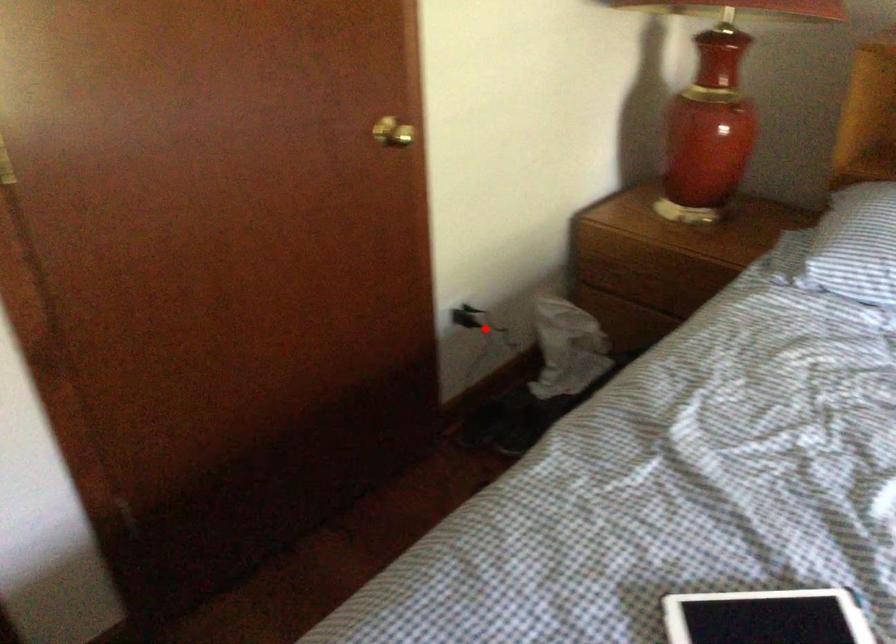
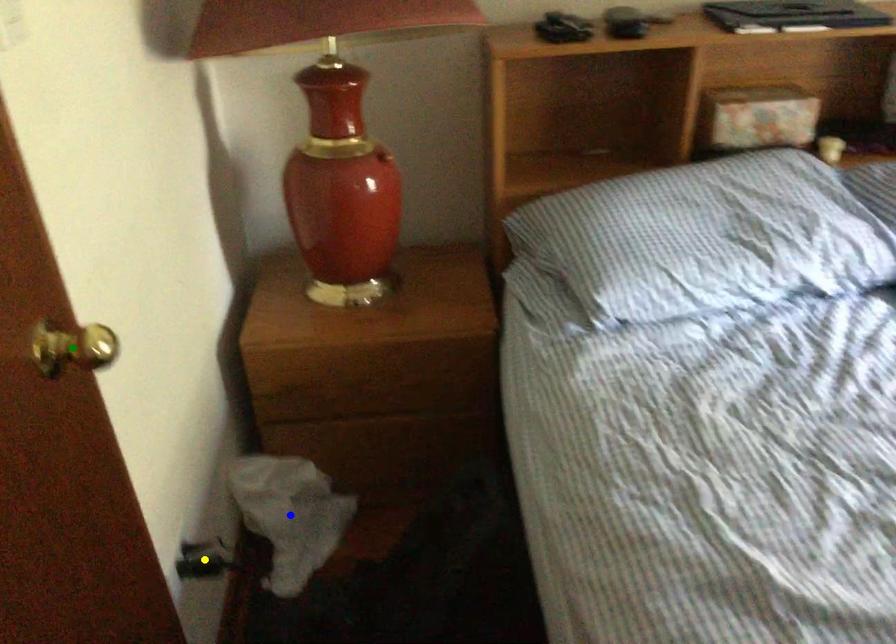
Question: I am providing you with two images of the same scene from different viewpoints. A red point is marked on the first image. You are given multiple points on the second image. Which point in image 2 is actually the same real-world point as the red point in image 1?

Choices:
 (A) green point
 (B) blue point
 (C) yellow point

Answer: (C)